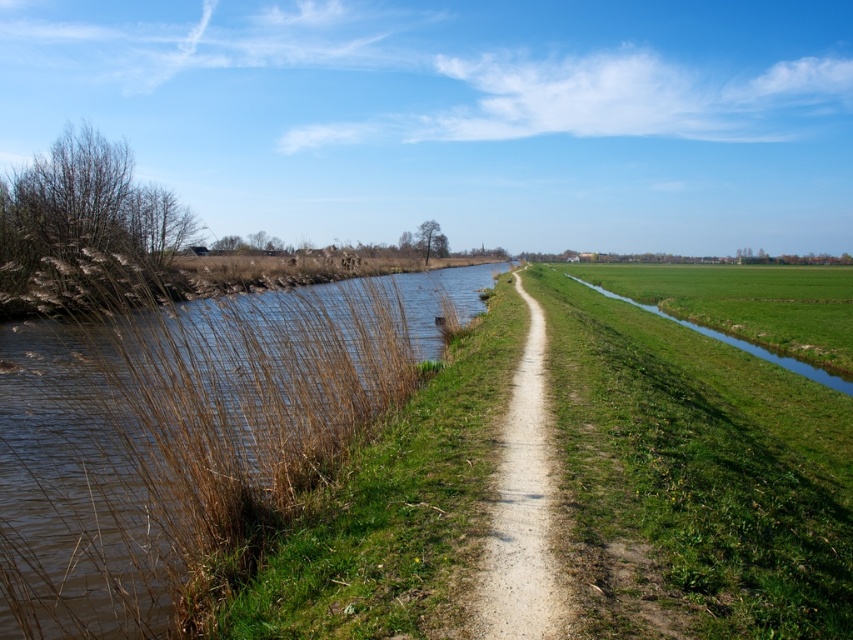
You are a hiker walking along the dirt path in the rural landscape. You want to cross to the field on the other side of the green grass at right. Which direction should you go to avoid the brown grassy stream at left?

To reach the field on the other side of the green grass at right while avoiding the brown grassy stream at left, you should head towards the right side of the path since the brown grassy stream at left is positioned on the left side of green grass at right.